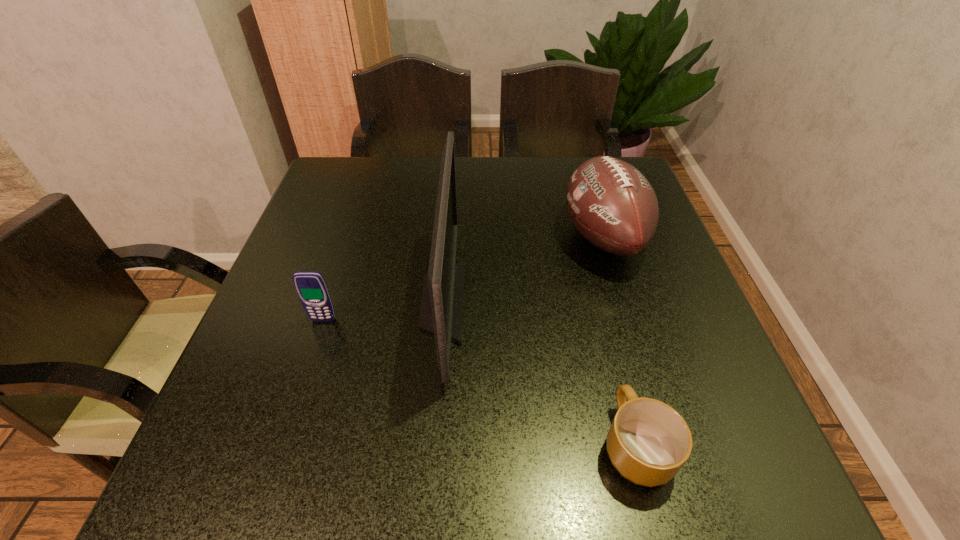
Identify the location of free space that satisfies the following two spatial constraints: 1. on the side with the handle of the nearest object; 2. on the right side of the football (American). Image resolution: width=960 pixels, height=540 pixels. (583, 237).